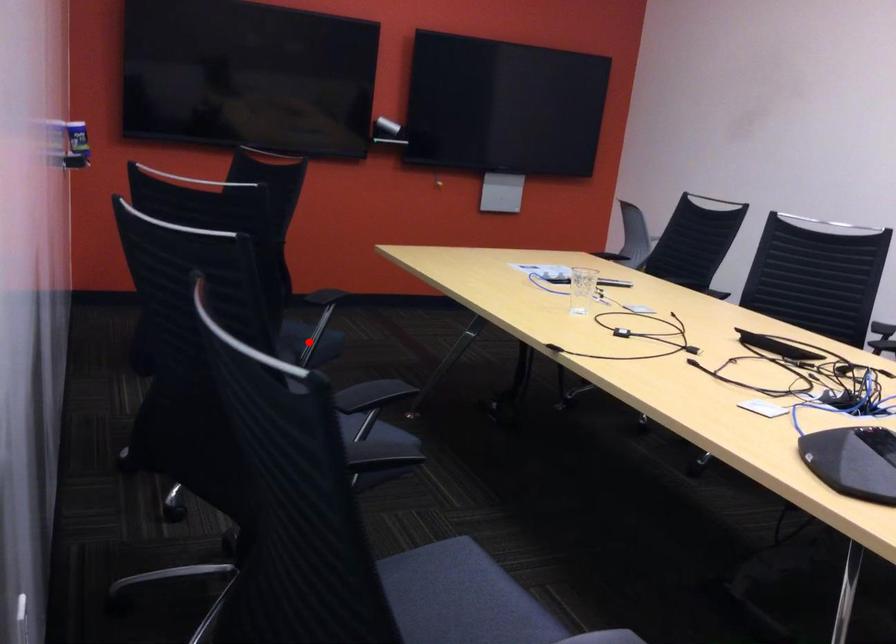
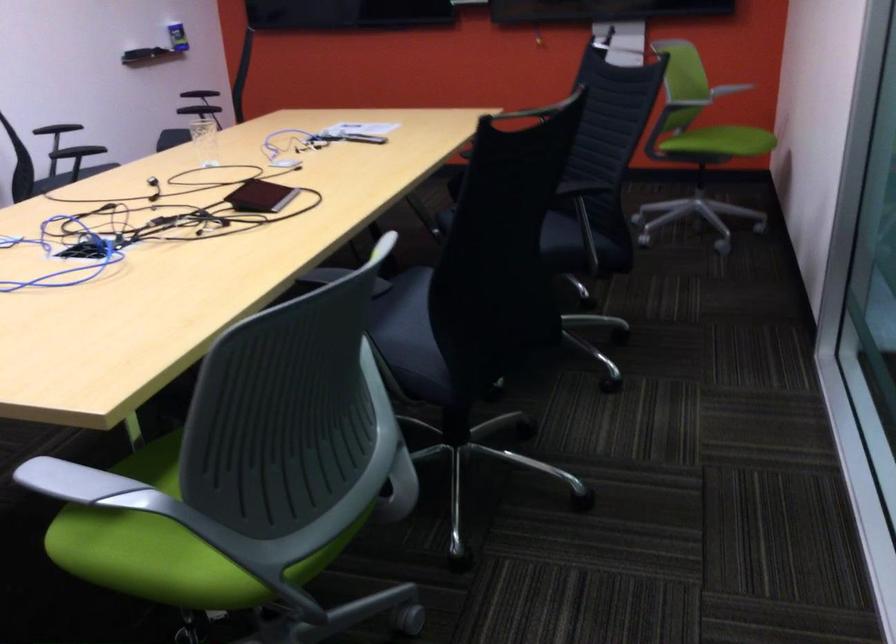
Question: I am providing you with two images of the same scene from different viewpoints. A red point is marked on the first image. Is the red point's position out of view in image 2?

Choices:
 (A) Yes
 (B) No

Answer: (A)